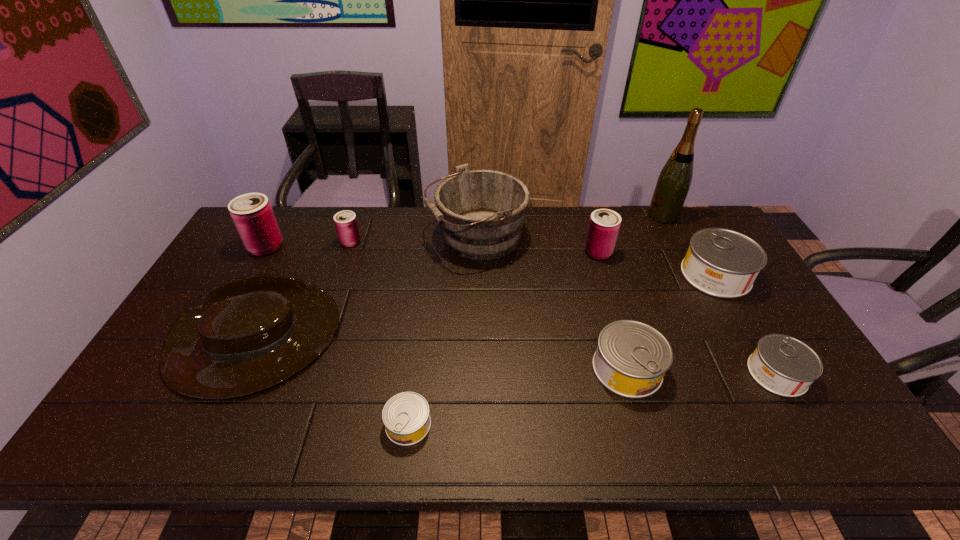
I want to click on free space located on the back of the leftmost pink can, so [285, 213].

You are a GUI agent. You are given a task and a screenshot of the screen. Output one action in this format:
    pyautogui.click(x=<x>, y=<y>)
    Task: Click on the vacant point located 0.200m on the front of the fourth tallest object
    The height and width of the screenshot is (540, 960).
    Given the screenshot: What is the action you would take?
    pyautogui.click(x=614, y=306)

The image size is (960, 540). Find the location of `vacant area situated on the left of the biggest silver can`. vacant area situated on the left of the biggest silver can is located at coordinates (584, 275).

Locate an element on the screen. The width and height of the screenshot is (960, 540). free location located 0.150m on the right of the smallest pink can is located at coordinates (405, 242).

Where is `free spot located 0.300m on the right of the cowboy hat`? This screenshot has height=540, width=960. free spot located 0.300m on the right of the cowboy hat is located at coordinates (444, 343).

The image size is (960, 540). I want to click on vacant space positioned 0.290m on the left of the third silver can from right to left, so click(x=480, y=369).

What are the coordinates of `blank space located on the back of the sixth tallest can` in the screenshot? It's located at (720, 275).

This screenshot has height=540, width=960. I want to click on vacant position located on the back of the nearest can, so click(420, 325).

The image size is (960, 540). I want to click on wine bottle that is at the far edge, so click(x=675, y=178).

Where is `wine bucket that is at the far edge`? Image resolution: width=960 pixels, height=540 pixels. wine bucket that is at the far edge is located at coordinates (481, 212).